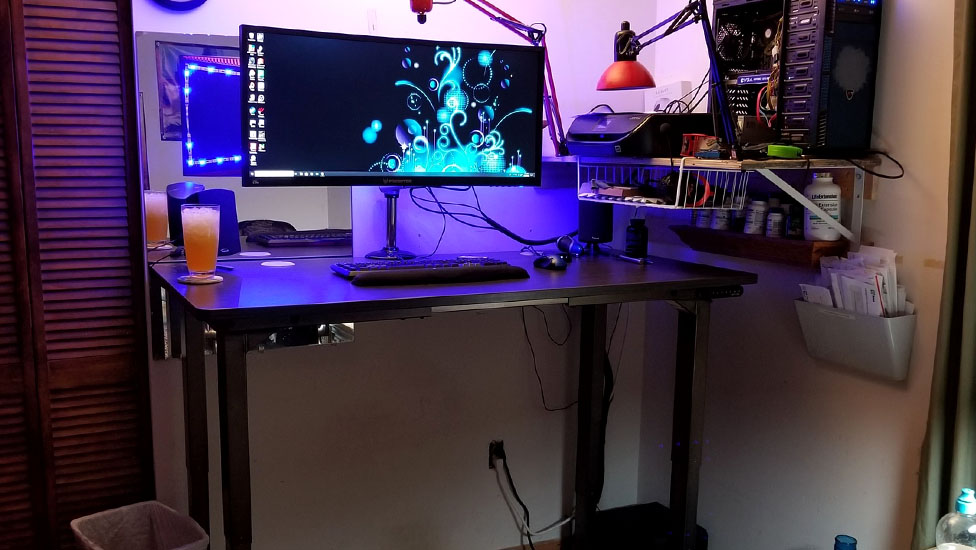
Find the location of `monitor`. monitor is located at coordinates (377, 140).